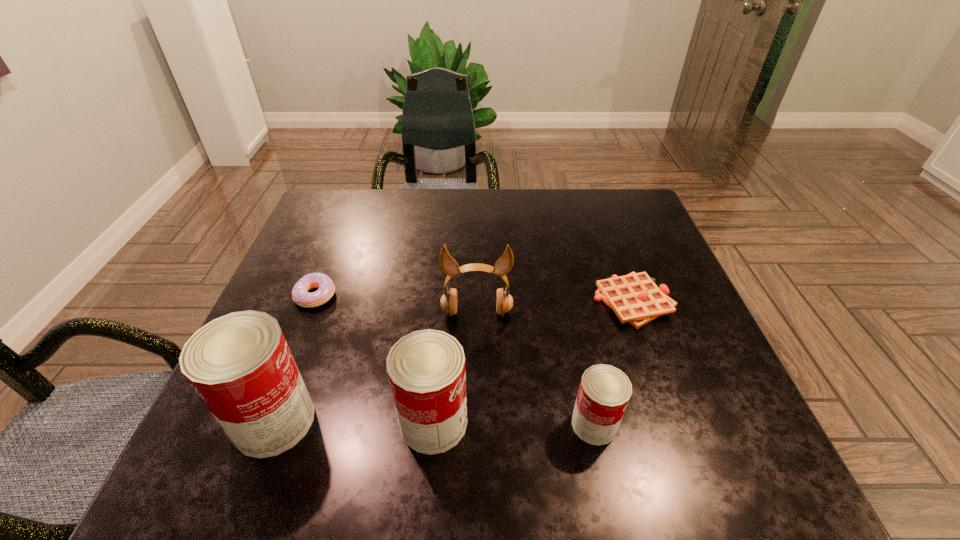
This screenshot has width=960, height=540. What are the coordinates of `vacant region located on the back of the doughnut` in the screenshot? It's located at (348, 212).

Image resolution: width=960 pixels, height=540 pixels. I want to click on vacant space located on the left of the rightmost object, so click(x=432, y=301).

Locate an element on the screen. The width and height of the screenshot is (960, 540). can that is at the left edge is located at coordinates (240, 365).

The image size is (960, 540). In order to click on doughnut at the left edge in this screenshot , I will do `click(300, 295)`.

Where is `object present at the right edge`? This screenshot has height=540, width=960. object present at the right edge is located at coordinates (635, 298).

I want to click on object at the near left corner, so click(x=240, y=365).

Where is `vacant space at the far edge of the desktop`? vacant space at the far edge of the desktop is located at coordinates (507, 202).

This screenshot has height=540, width=960. I want to click on vacant space at the near edge of the desktop, so click(x=352, y=411).

Locate an element on the screen. vacant space at the far left corner of the desktop is located at coordinates (331, 205).

Identify the location of empty location between the waffle and the doughnut. This screenshot has height=540, width=960. (474, 299).